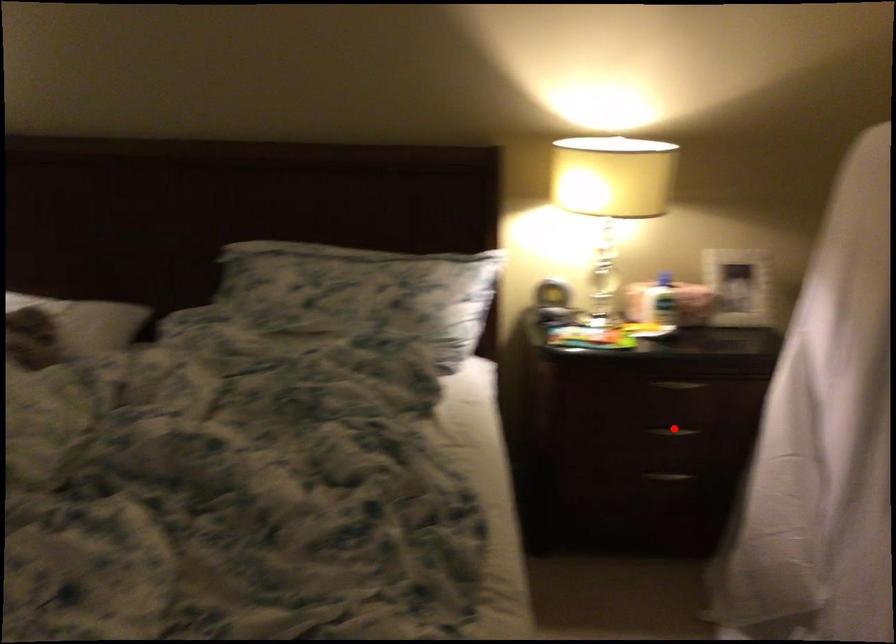
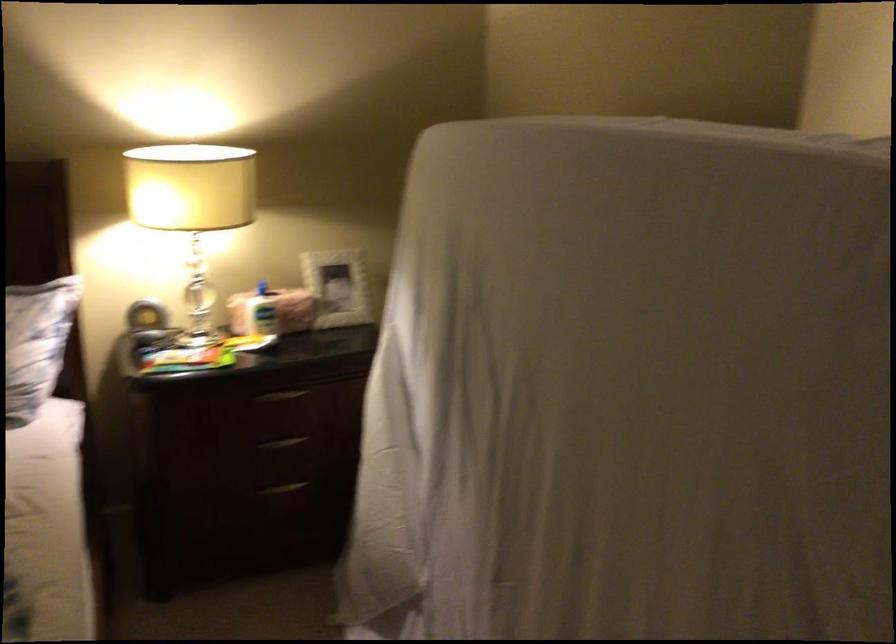
Where in the second image is the point corresponding to the highlighted location from the first image?

(282, 442)